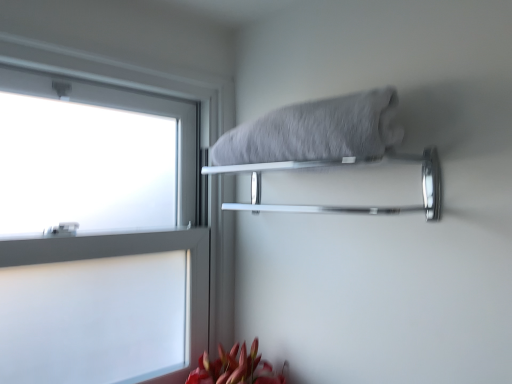
Question: Is chrome metallic towel bar at upper center positioned beyond the bounds of white frosted glass at left?

Choices:
 (A) yes
 (B) no

Answer: (A)

Question: Considering the relative sizes of chrome metallic towel bar at upper center and white frosted glass at left in the image provided, is chrome metallic towel bar at upper center taller than white frosted glass at left?

Choices:
 (A) no
 (B) yes

Answer: (A)

Question: Is chrome metallic towel bar at upper center wider than white frosted glass at left?

Choices:
 (A) no
 (B) yes

Answer: (B)

Question: Does chrome metallic towel bar at upper center have a larger size compared to white frosted glass at left?

Choices:
 (A) yes
 (B) no

Answer: (B)

Question: Can you confirm if chrome metallic towel bar at upper center is smaller than white frosted glass at left?

Choices:
 (A) yes
 (B) no

Answer: (A)

Question: From the image's perspective, is chrome metallic towel bar at upper center positioned above or below white frosted glass at left?

Choices:
 (A) below
 (B) above

Answer: (B)

Question: Considering the positions of chrome metallic towel bar at upper center and white frosted glass at left in the image, is chrome metallic towel bar at upper center wider or thinner than white frosted glass at left?

Choices:
 (A) wide
 (B) thin

Answer: (A)

Question: From a real-world perspective, is chrome metallic towel bar at upper center positioned above or below white frosted glass at left?

Choices:
 (A) above
 (B) below

Answer: (A)

Question: From their relative heights in the image, would you say chrome metallic towel bar at upper center is taller or shorter than white frosted glass at left?

Choices:
 (A) tall
 (B) short

Answer: (B)

Question: Is gray fluffy towel at upper center taller or shorter than chrome metallic towel bar at upper center?

Choices:
 (A) tall
 (B) short

Answer: (A)

Question: Is gray fluffy towel at upper center wider or thinner than chrome metallic towel bar at upper center?

Choices:
 (A) wide
 (B) thin

Answer: (A)

Question: Is point (385, 132) positioned closer to the camera than point (350, 157)?

Choices:
 (A) farther
 (B) closer

Answer: (B)

Question: Visually, is gray fluffy towel at upper center positioned to the left or to the right of chrome metallic towel bar at upper center?

Choices:
 (A) right
 (B) left

Answer: (A)

Question: From a real-world perspective, is white frosted glass at left positioned above or below chrome metallic towel bar at upper center?

Choices:
 (A) below
 (B) above

Answer: (A)

Question: Looking at the image, does white frosted glass at left seem bigger or smaller compared to chrome metallic towel bar at upper center?

Choices:
 (A) small
 (B) big

Answer: (B)